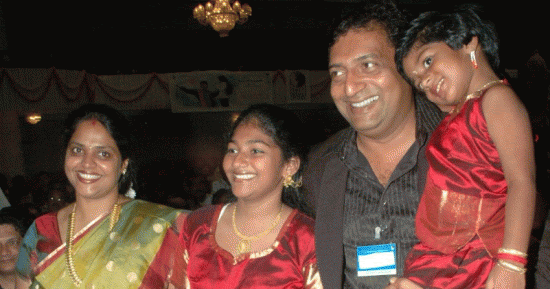
Image resolution: width=550 pixels, height=289 pixels. Identify the location of poster. pyautogui.click(x=220, y=96).